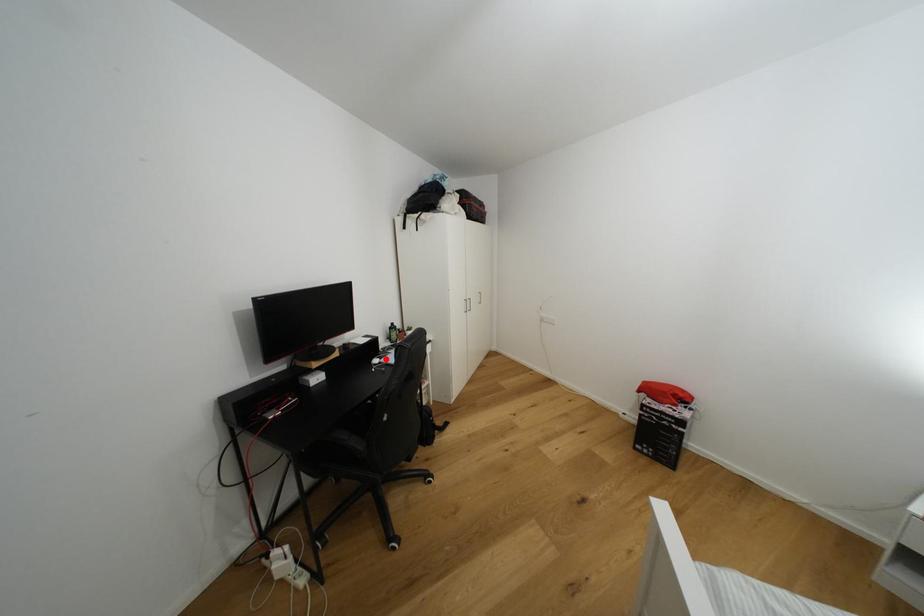
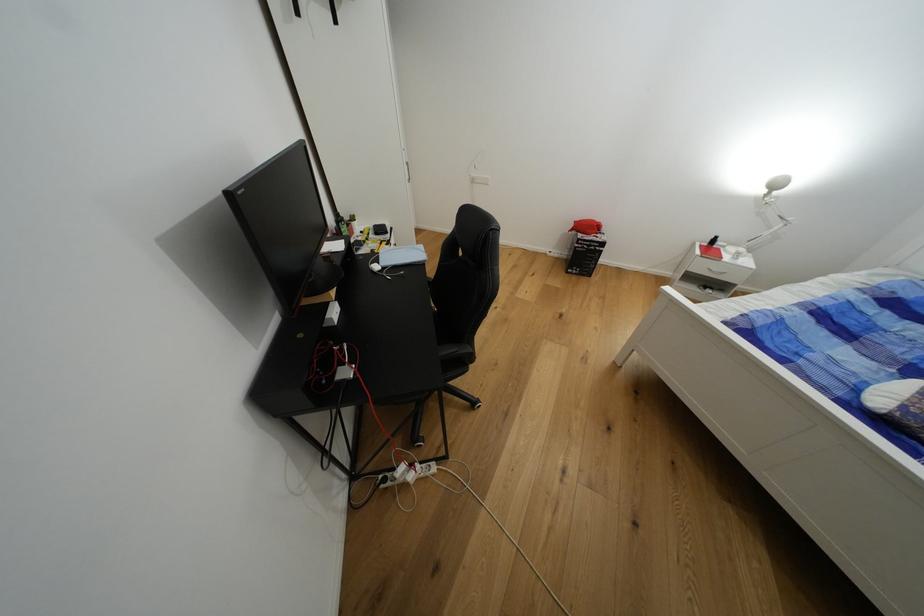
Locate, in the second image, the point that corresponds to the highlighted location in the first image.

(383, 262)